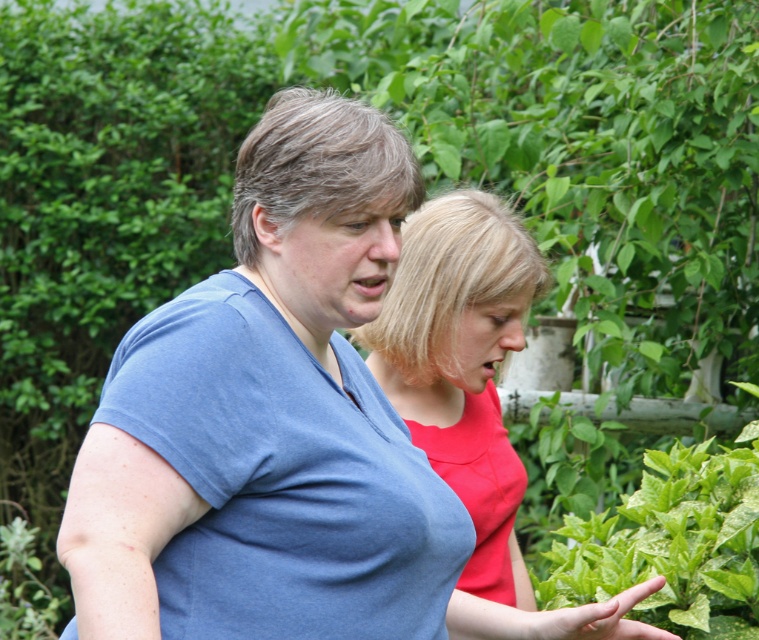
You are a photographer trying to capture a photo of both the blue cotton shirt at center and the matte red blouse at center. Which one should you focus on first to ensure both are in frame?

The blue cotton shirt at center is much taller than the matte red blouse at center, so you should focus on the blue cotton shirt at center first to ensure both are in frame.

Looking at this image, you are standing in a garden where two people are talking. The person on the left is pointing something out, and the person on the right is listening. You need to locate the blue cotton shirt at center. According to the coordinates provided, where exactly is the blue cotton shirt located in the image?

The blue cotton shirt at center is located at coordinates point (x=269, y=419).

You are a photographer trying to capture a photo where the matte red blouse at center and the green leafy plant at center are both in focus. Since you know the camera can only focus on one subject at a time, which object should you focus on to ensure both are sharp?

You should focus on the matte red blouse at center because it is closer to the camera than the green leafy plant at center, ensuring both are in focus.